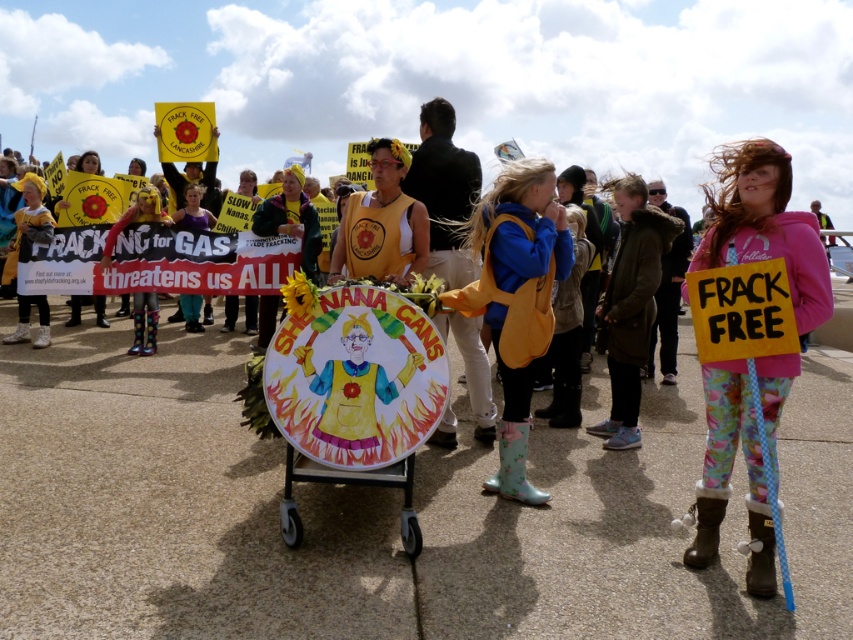
Is pink fleece jacket at right bigger than blue fabric backpack at center?

Correct, pink fleece jacket at right is larger in size than blue fabric backpack at center.

Is point (706, 243) farther from camera compared to point (527, 225)?

No, it is in front of (527, 225).

Identify the location of pink fleece jacket at right. The image size is (853, 640). (764, 225).